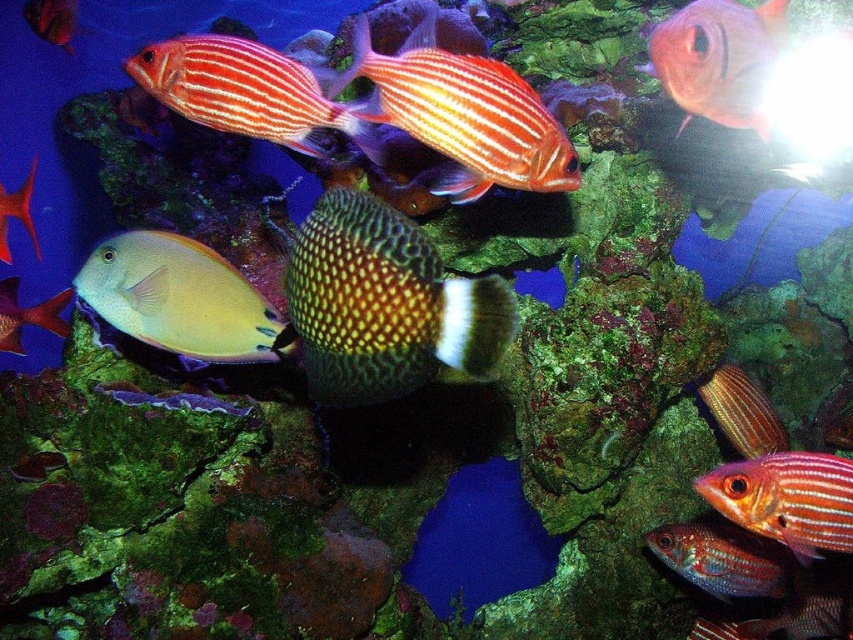
Measure the distance between shiny red fish at right and matte yellow fish at center.

They are 5.20 feet apart.

Locate an element on the screen. The image size is (853, 640). shiny red fish at right is located at coordinates (786, 499).

I want to click on shiny red fish at right, so click(786, 499).

Does green textured fish at center appear on the right side of orange striped fish at upper center?

Correct, you'll find green textured fish at center to the right of orange striped fish at upper center.

Does green textured fish at center have a lesser width compared to orange striped fish at upper center?

Correct, green textured fish at center's width is less than orange striped fish at upper center's.

Between point (305, 320) and point (160, 42), which one is positioned behind?

The point (160, 42) is more distant.

Identify the location of green textured fish at center. The image size is (853, 640). (384, 305).

Which is more to the left, shiny red fish at right or matte yellow fish at left?

matte yellow fish at left

Is shiny red fish at right to the left of matte yellow fish at left from the viewer's perspective?

In fact, shiny red fish at right is to the right of matte yellow fish at left.

The width and height of the screenshot is (853, 640). Describe the element at coordinates (786, 499) in the screenshot. I see `shiny red fish at right` at that location.

Locate an element on the screen. The image size is (853, 640). shiny red fish at right is located at coordinates (786, 499).